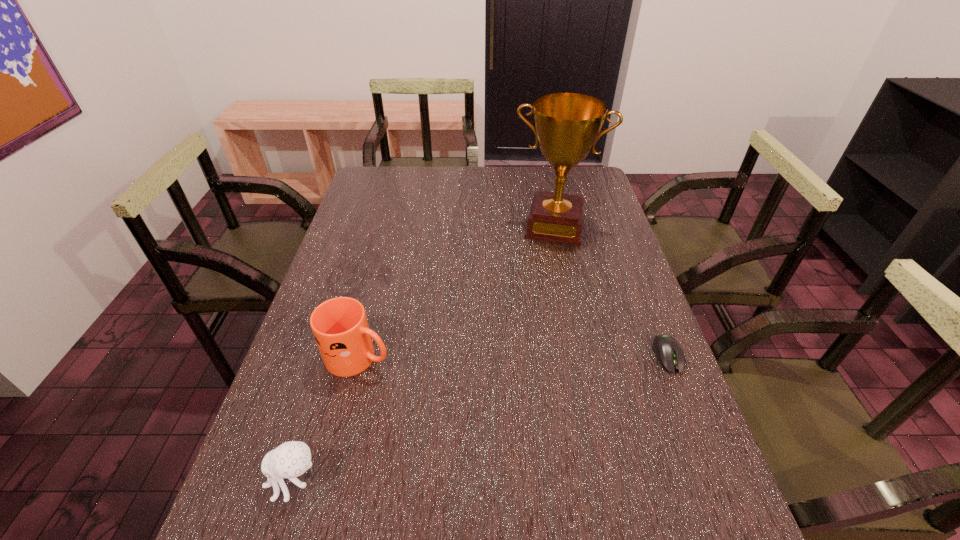
I want to click on unoccupied area between the nearest object and the third shortest object, so click(x=326, y=418).

The image size is (960, 540). Identify the location of vacant area that lies between the third shortest object and the farthest object. (457, 291).

This screenshot has height=540, width=960. What are the coordinates of `vacant area between the octopus and the rightmost object` in the screenshot? It's located at (481, 418).

This screenshot has height=540, width=960. In order to click on vacant space that is in between the third shortest object and the third tallest object in this screenshot , I will do `click(326, 418)`.

Where is `free space that is in between the second tallest object and the third tallest object`? free space that is in between the second tallest object and the third tallest object is located at coordinates (326, 418).

Identify the location of object that stands as the closest to the third shortest object. (291, 459).

Locate which object ranks in proximity to the third shortest object. Please provide its 2D coordinates. Your answer should be formatted as a tuple, i.e. [(x, y)], where the tuple contains the x and y coordinates of a point satisfying the conditions above.

[(291, 459)]

Identify the location of vacant space that satisfies the following two spatial constraints: 1. on the back side of the tallest object; 2. on the right side of the third shortest object. (393, 226).